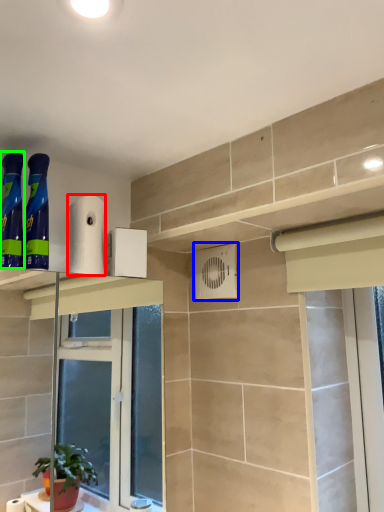
Question: Which object is positioned closest to toilet paper (highlighted by a red box)? Select from air conditioning (highlighted by a blue box) and cleaning product (highlighted by a green box).

Choices:
 (A) air conditioning
 (B) cleaning product

Answer: (B)